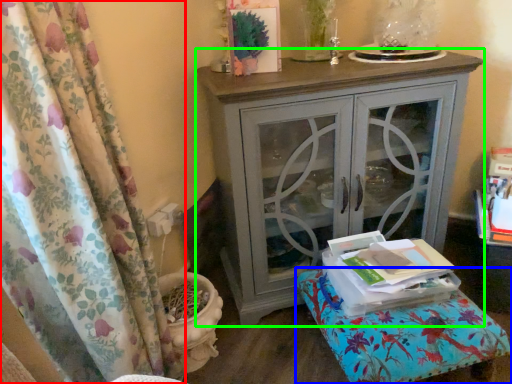
Question: Which object is the farthest from curtain (highlighted by a red box)? Choose among these: furniture (highlighted by a blue box) or nightstand (highlighted by a green box).

Choices:
 (A) furniture
 (B) nightstand

Answer: (A)